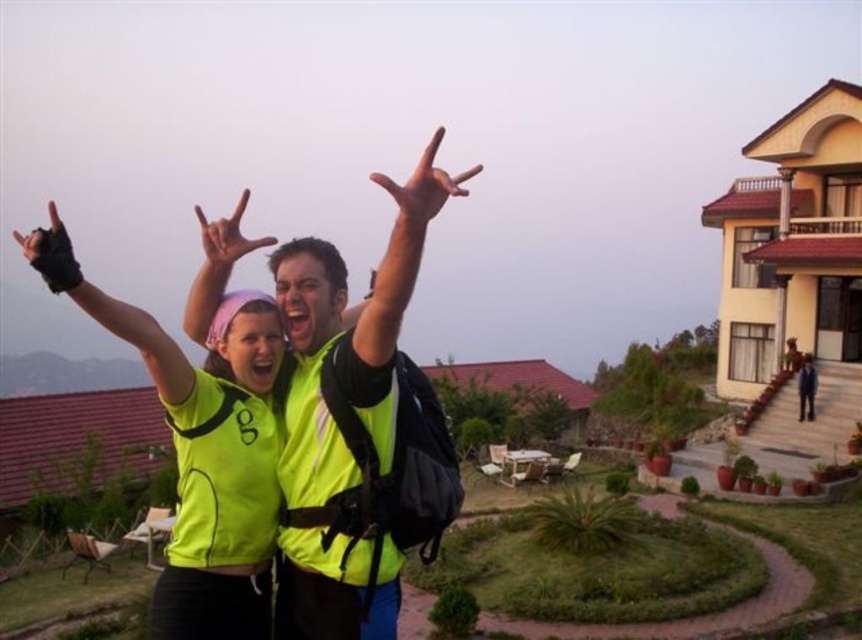
Can you confirm if neon yellow fabric at upper center is shorter than blue fabric jacket at center?

In fact, neon yellow fabric at upper center may be taller than blue fabric jacket at center.

Is point (235, 259) less distant than point (800, 419)?

Yes, it is.

Where is `neon yellow fabric at upper center`? The height and width of the screenshot is (640, 862). neon yellow fabric at upper center is located at coordinates (216, 268).

Image resolution: width=862 pixels, height=640 pixels. Describe the element at coordinates (216, 268) in the screenshot. I see `neon yellow fabric at upper center` at that location.

Locate an element on the screen. neon yellow fabric at upper center is located at coordinates (216, 268).

Between green matte vest at upper center and blue fabric jacket at center, which one has more height?

green matte vest at upper center

Between point (423, 179) and point (798, 390), which one is positioned behind?

Point (798, 390)

Locate an element on the screen. green matte vest at upper center is located at coordinates (400, 256).